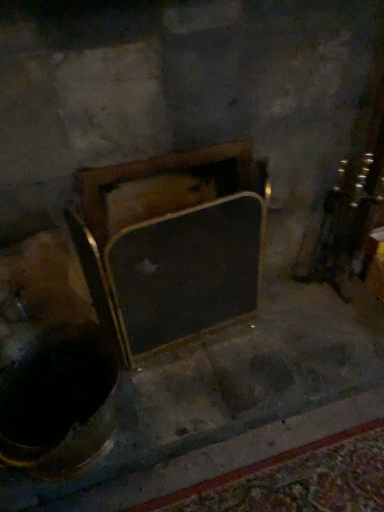
Locate an element on the screen. free point below metallic gold frame at center (from a real-world perspective) is located at coordinates (202, 337).